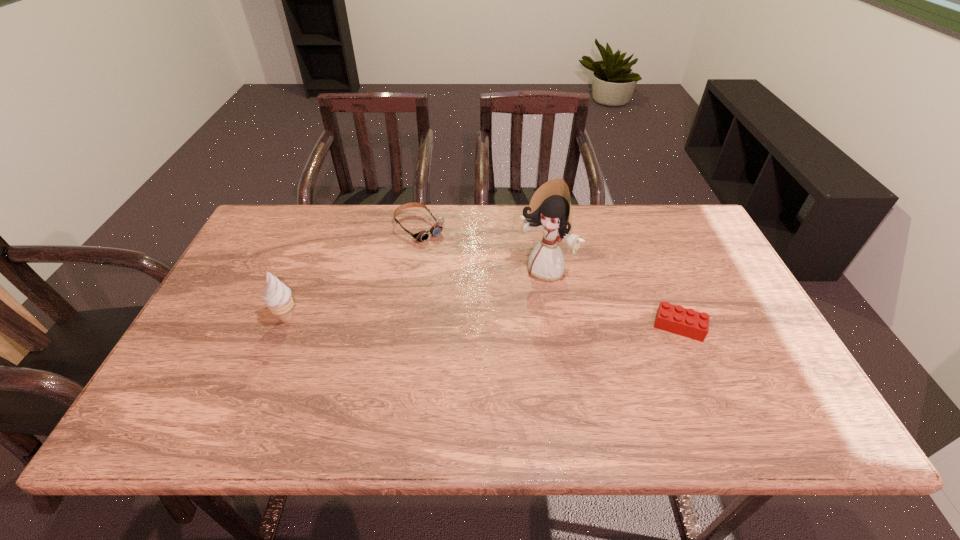
This screenshot has width=960, height=540. I want to click on the leftmost object, so click(278, 299).

Find the location of a particular element. icecream is located at coordinates 278,299.

This screenshot has height=540, width=960. I want to click on the rightmost object, so click(x=689, y=323).

The height and width of the screenshot is (540, 960). I want to click on Lego, so click(x=689, y=323).

Locate an element on the screen. Image resolution: width=960 pixels, height=540 pixels. doll is located at coordinates (550, 209).

Where is `the tallest object`? The image size is (960, 540). the tallest object is located at coordinates click(550, 209).

The height and width of the screenshot is (540, 960). What are the coordinates of `the second object from left to right` in the screenshot? It's located at (422, 236).

What are the coordinates of `the farthest object` in the screenshot? It's located at (422, 236).

I want to click on free space located on the front-facing side of the leftmost object, so click(216, 319).

Where is `free location located 0.050m on the front-facing side of the leftmost object`? The height and width of the screenshot is (540, 960). free location located 0.050m on the front-facing side of the leftmost object is located at coordinates (254, 319).